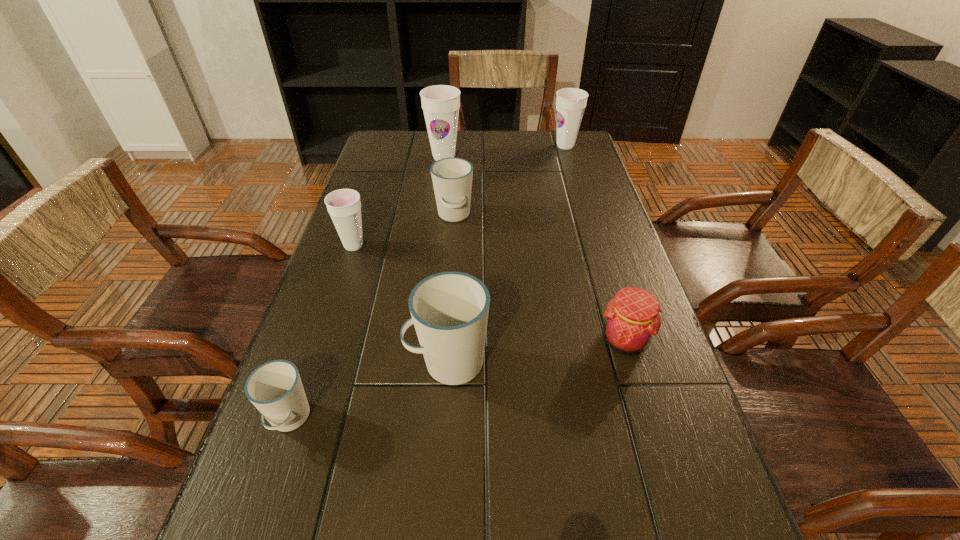
This screenshot has height=540, width=960. In order to click on the biggest purple cup in this screenshot , I will do `click(440, 103)`.

What are the coordinates of `the tallest cup` in the screenshot? It's located at [x=440, y=103].

At what (x,y) coordinates should I click in order to perform the action: click on the second biggest purple cup. Please return your answer as a coordinate pair (x, y). Image resolution: width=960 pixels, height=540 pixels. Looking at the image, I should click on (570, 102).

Where is `the rightmost cup`? Image resolution: width=960 pixels, height=540 pixels. the rightmost cup is located at coordinates (570, 102).

The height and width of the screenshot is (540, 960). Identify the location of the second farthest white cup. (449, 310).

Locate an element on the screen. the fifth farthest cup is located at coordinates (449, 310).

The width and height of the screenshot is (960, 540). What are the coordinates of `the third farthest object` in the screenshot? It's located at (452, 177).

Find the location of a particular element. This screenshot has height=540, width=960. the farthest white cup is located at coordinates (452, 177).

The width and height of the screenshot is (960, 540). Find the location of `the fourth nearest object`. the fourth nearest object is located at coordinates (344, 206).

Where is `the fourth farthest cup`? The height and width of the screenshot is (540, 960). the fourth farthest cup is located at coordinates (344, 206).